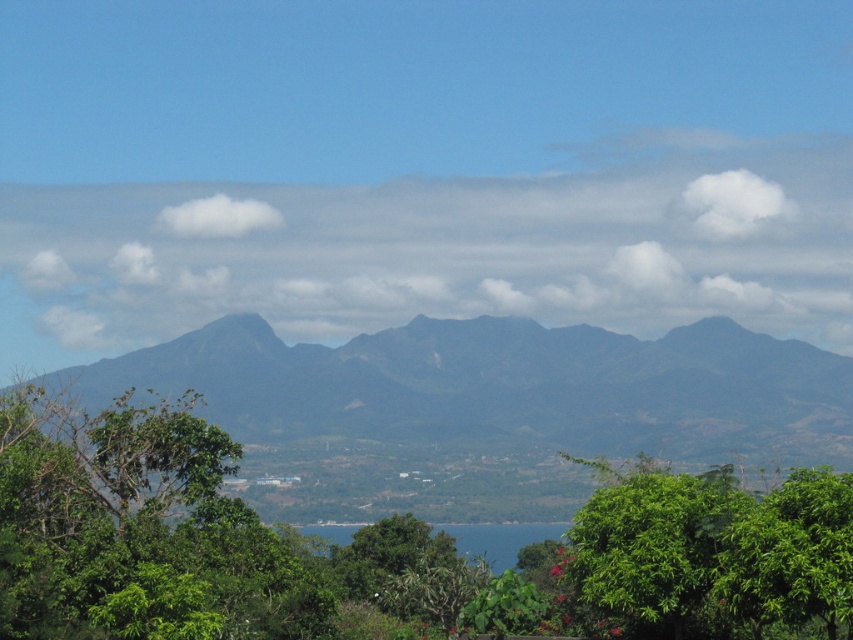
You are standing at the viewpoint in the image and want to reach the point marked as point (122,573). If your walking speed is 1.5 meters per second, how many seconds will it take you to reach that point?

The distance between you and point (122,573) is 41.34 meters. At a walking speed of 1.5 meters per second, the time required is 41.34 divided by 1.5, which equals approximately 27.56 seconds. Therefore, it will take about 28 seconds to reach the point.

Looking at this image, you are standing at the point closest to the bottom of the image and want to walk towards the mountain range in the background. Which point, point (311,396) or point (57,604), would you pass through first?

You would pass through point (57,604) first because it is closer to you than point (311,396), which is further away in the background.